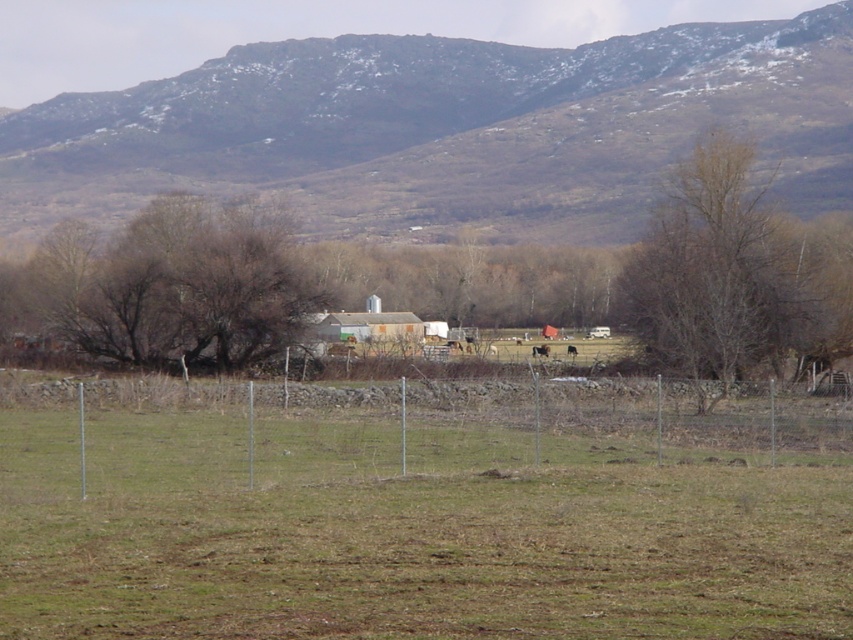
Question: Among these points, which one is farthest from the camera?

Choices:
 (A) (686, 172)
 (B) (573, 355)

Answer: (A)

Question: Can you confirm if brown leafless tree at center is positioned above bare wood tree at right?

Choices:
 (A) no
 (B) yes

Answer: (B)

Question: Is brown leafless tree at center further to camera compared to bare wood tree at right?

Choices:
 (A) yes
 (B) no

Answer: (A)

Question: Which point is farther to the camera?

Choices:
 (A) metal wire fence at lower center
 (B) brown furry cow at center

Answer: (B)

Question: Does brown leafless tree at center appear under brown furry cow at center?

Choices:
 (A) no
 (B) yes

Answer: (A)

Question: Which object appears closest to the camera in this image?

Choices:
 (A) brown fuzzy horse at center
 (B) brown furry cow at center
 (C) bare wood tree at right

Answer: (C)